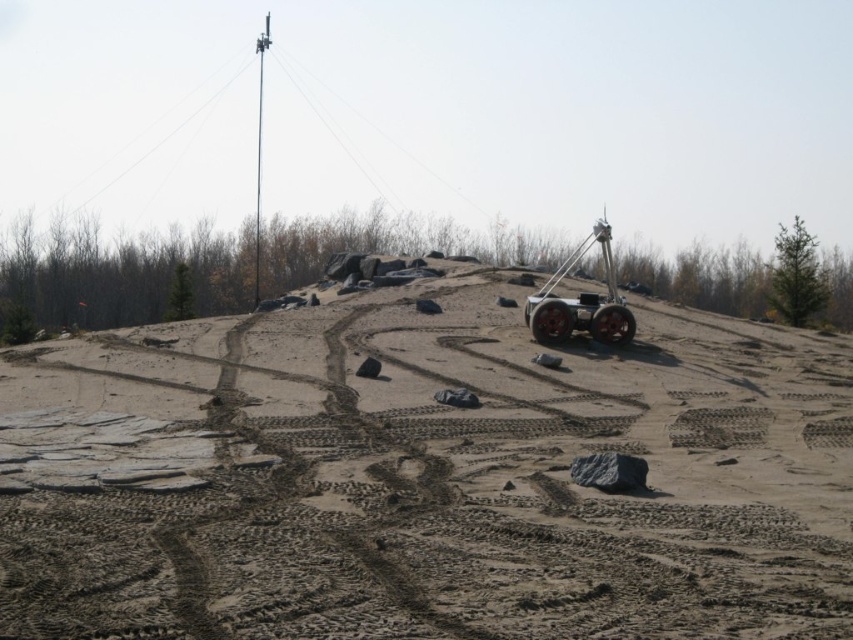
Who is lower down, brown sandy terrain at center or rubber/textured tire at center-right?

Positioned lower is brown sandy terrain at center.

Can you confirm if brown sandy terrain at center is taller than rubber/textured tire at center-right?

Correct, brown sandy terrain at center is much taller as rubber/textured tire at center-right.

This screenshot has width=853, height=640. What are the coordinates of `brown sandy terrain at center` in the screenshot? It's located at (424, 480).

Which is below, black rubber tire at center or rubber/textured tire at center-right?

rubber/textured tire at center-right is below.

Which of these two, black rubber tire at center or rubber/textured tire at center-right, stands shorter?

rubber/textured tire at center-right

Locate an element on the screen. This screenshot has width=853, height=640. black rubber tire at center is located at coordinates (550, 321).

Between brown sandy terrain at center and black rubber tire at center, which one appears on the right side from the viewer's perspective?

black rubber tire at center is more to the right.

Does brown sandy terrain at center appear over black rubber tire at center?

Incorrect, brown sandy terrain at center is not positioned above black rubber tire at center.

Locate an element on the screen. This screenshot has height=640, width=853. brown sandy terrain at center is located at coordinates (424, 480).

You are a GUI agent. You are given a task and a screenshot of the screen. Output one action in this format:
    pyautogui.click(x=<x>, y=<y>)
    Task: Click on the brown sandy terrain at center
    This screenshot has width=853, height=640.
    Given the screenshot: What is the action you would take?
    (x=424, y=480)